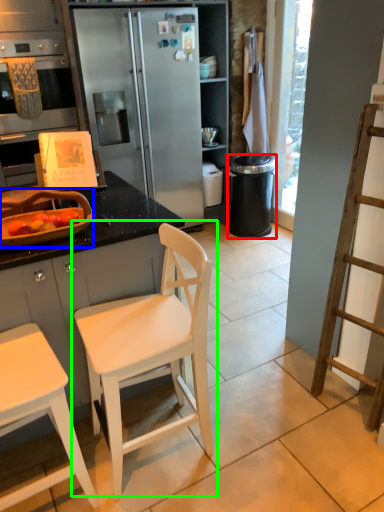
Question: Estimate the real-world distances between objects in this image. Which object is farther from trash bin/can (highlighted by a red box), appliance (highlighted by a blue box) or chair (highlighted by a green box)?

Choices:
 (A) appliance
 (B) chair

Answer: (A)